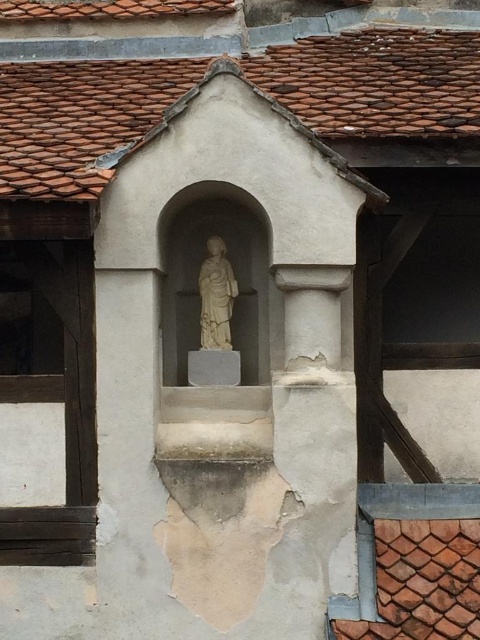
Who is positioned more to the right, brown clay tiles at upper center or white marble statue at center?

brown clay tiles at upper center

Between point (132, 92) and point (204, 310), which one is positioned behind?

Positioned behind is point (132, 92).

At what (x,y) coordinates should I click in order to perform the action: click on brown clay tiles at upper center. Please return your answer as a coordinate pair (x, y). Looking at the image, I should click on (375, 83).

Does wooden window at left have a greater height compared to white stone statue at center?

Yes, wooden window at left is taller than white stone statue at center.

Is wooden window at left thinner than white stone statue at center?

Yes.

Measure the distance between wooden window at left and camera.

A distance of 5.40 meters exists between wooden window at left and camera.

Where is `wooden window at left`? The image size is (480, 640). wooden window at left is located at coordinates (48, 380).

Does white stone statue at center appear on the right side of white marble statue at center?

No, white stone statue at center is not to the right of white marble statue at center.

Can you confirm if white stone statue at center is thinner than white marble statue at center?

No.

This screenshot has width=480, height=640. Identify the location of white stone statue at center. (199, 276).